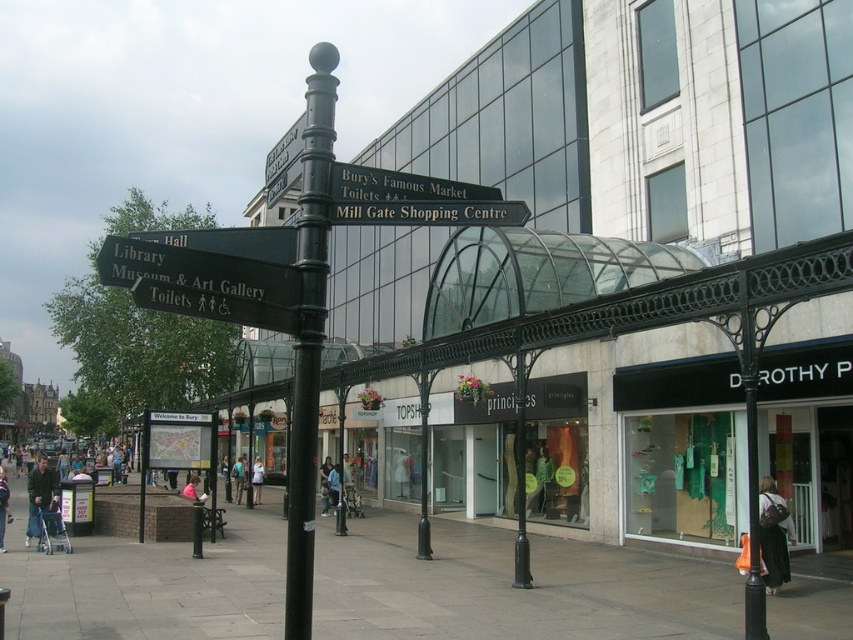
Between black metal pole at center and matte brick building at left, which one appears on the right side from the viewer's perspective?

black metal pole at center is more to the right.

Is point (309, 410) closer to camera compared to point (30, 433)?

Yes, it is.

What are the coordinates of `black metal pole at center` in the screenshot? It's located at (309, 333).

Can you confirm if black metal pole at center is wider than dark blue jeans at lower left?

No.

This screenshot has width=853, height=640. What do you see at coordinates (309, 333) in the screenshot?
I see `black metal pole at center` at bounding box center [309, 333].

Locate an element on the screen. This screenshot has width=853, height=640. black metal pole at center is located at coordinates (309, 333).

Who is shorter, dark blue jeans at lower left or light blue jeans at lower left?

With less height is light blue jeans at lower left.

Does dark blue jeans at lower left have a lesser width compared to light blue jeans at lower left?

In fact, dark blue jeans at lower left might be wider than light blue jeans at lower left.

Between point (44, 502) and point (3, 484), which one is positioned in front?

Point (3, 484)

Locate an element on the screen. Image resolution: width=853 pixels, height=640 pixels. dark blue jeans at lower left is located at coordinates (54, 506).